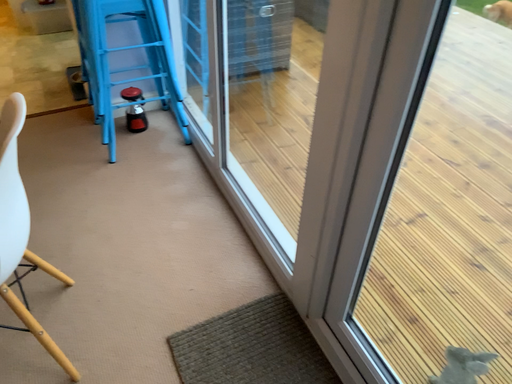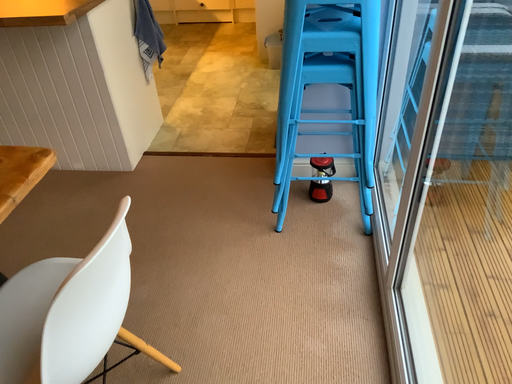
Question: How did the camera likely rotate when shooting the video?

Choices:
 (A) rotated right
 (B) rotated left

Answer: (B)